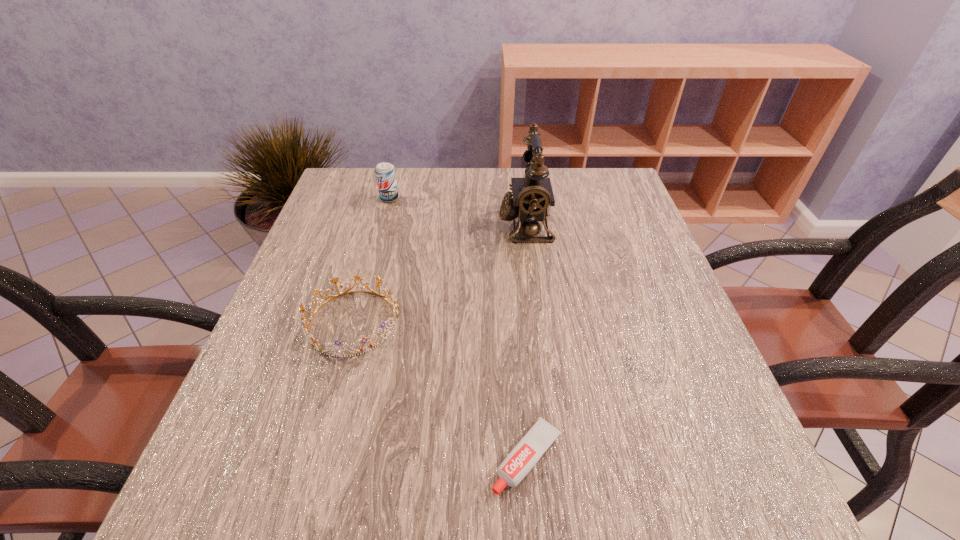
Locate an element on the screen. Image resolution: width=960 pixels, height=540 pixels. the tallest object is located at coordinates (530, 201).

You are a GUI agent. You are given a task and a screenshot of the screen. Output one action in this format:
    pyautogui.click(x=<x>, y=<y>)
    Task: Click on the beer can
    The height and width of the screenshot is (540, 960).
    Given the screenshot: What is the action you would take?
    pyautogui.click(x=385, y=174)

You are a GUI agent. You are given a task and a screenshot of the screen. Output one action in this format:
    pyautogui.click(x=<x>, y=<y>)
    Task: Click on the tiara
    The height and width of the screenshot is (540, 960).
    Given the screenshot: What is the action you would take?
    pyautogui.click(x=394, y=304)

At what (x,y) coordinates should I click in order to perform the action: click on the second nearest object. Please return your answer as a coordinate pair (x, y). This screenshot has width=960, height=540. Looking at the image, I should click on (394, 304).

Where is `the shortest object`? the shortest object is located at coordinates (524, 456).

This screenshot has height=540, width=960. What are the coordinates of `the nearest object` in the screenshot? It's located at (524, 456).

Find the location of a particular element. vacant space located 0.300m on the rotary dial of the telephone is located at coordinates (376, 225).

Find the location of a particular element. free location located on the rotary dial of the telephone is located at coordinates (425, 225).

This screenshot has height=540, width=960. I want to click on vacant space located 0.070m on the rotary dial of the telephone, so click(470, 225).

Where is `blank space located 0.060m on the right of the second tallest object`? Image resolution: width=960 pixels, height=540 pixels. blank space located 0.060m on the right of the second tallest object is located at coordinates (421, 199).